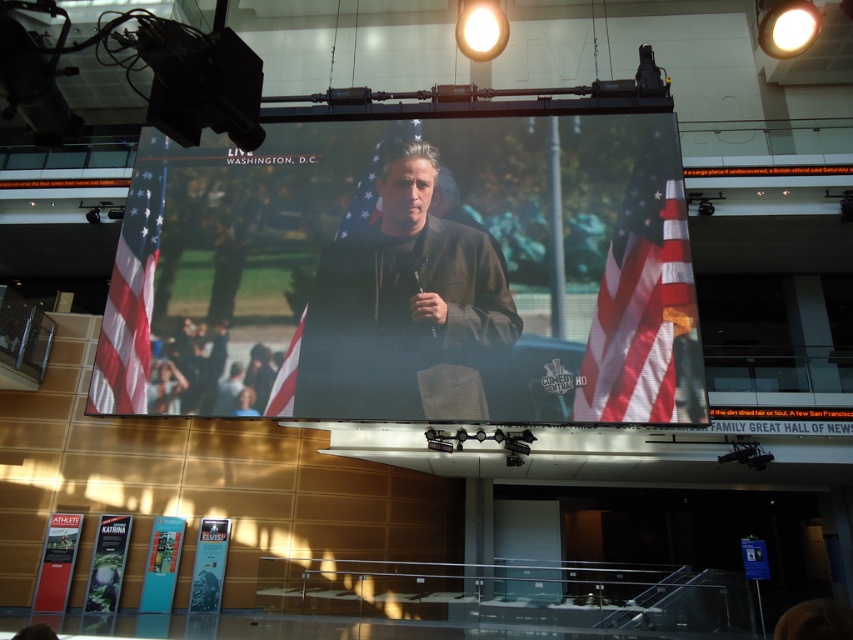
Question: Which of the following is the closest to the observer?

Choices:
 (A) (271, 397)
 (B) (126, 403)
 (C) (692, 278)
 (D) (422, 156)

Answer: (A)

Question: Is matte black screen at center wider than red-white-striped flag at left?

Choices:
 (A) yes
 (B) no

Answer: (A)

Question: Which of the following is the farthest from the observer?

Choices:
 (A) (428, 410)
 (B) (412, 124)

Answer: (B)

Question: Where is matte american flag at right located in relation to red-white-striped flag at left in the image?

Choices:
 (A) below
 (B) above

Answer: (B)

Question: Observing the image, what is the correct spatial positioning of brown leather jacket at center in reference to matte american flag at right?

Choices:
 (A) below
 (B) above

Answer: (A)

Question: Among these points, which one is nearest to the camera?

Choices:
 (A) pos(662,339)
 (B) pos(146,336)
 (C) pos(287,352)

Answer: (A)